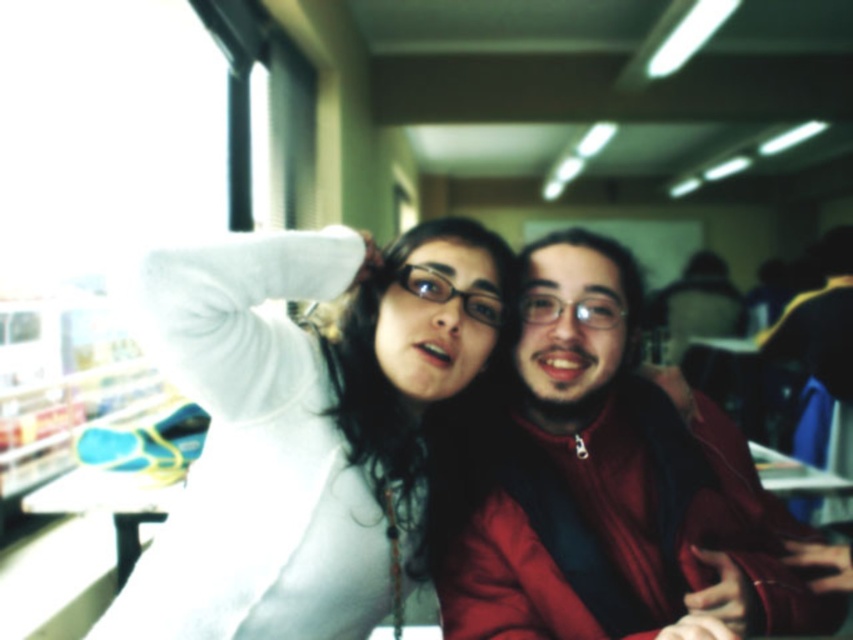
Does point (154, 304) lie in front of point (815, 612)?

That is True.

Can you confirm if white matte sweater at center is wider than matte red jacket at center?

No.

Is point (241, 252) farther from camera compared to point (685, 595)?

No, it is not.

Identify the location of white matte sweater at center. Image resolution: width=853 pixels, height=640 pixels. (311, 426).